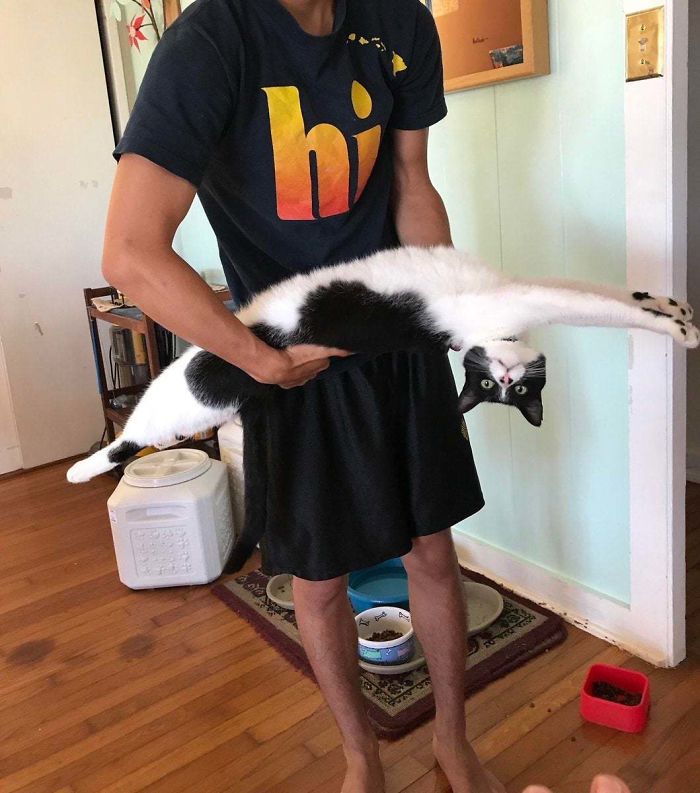
Where is `floor`? The width and height of the screenshot is (700, 793). floor is located at coordinates (251, 703).